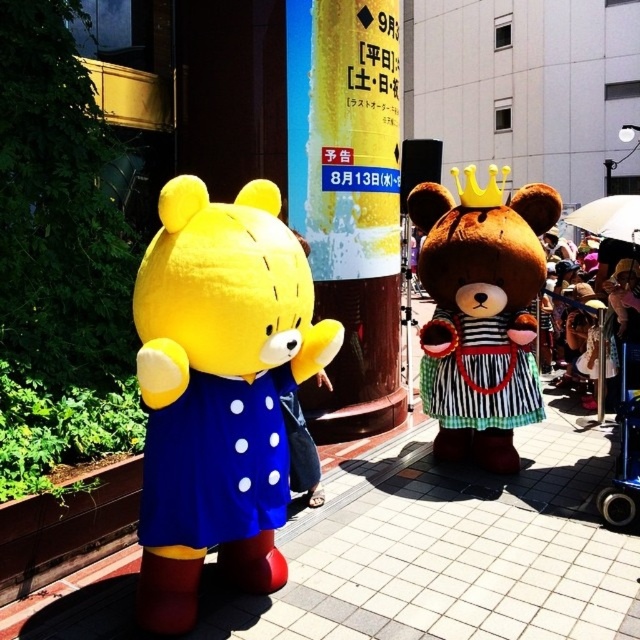
You are a street performer trying to set up a small stage for a show. You have a stage that is exactly the width of the blue fabric dress at left. Can you place this stage on the smooth concrete pavement at center without it overhanging the edges?

The smooth concrete pavement at center is wider than the blue fabric dress at left, so yes, the stage can be placed on the smooth concrete pavement at center without overhanging since its width is sufficient.

You are a visitor at this event and want to read the yellow fabric signpost at center. However, you notice the brown plush bear at center is blocking your view. Can you see the signpost clearly?

The yellow fabric signpost at center is located above the brown plush bear at center, so you can see the signpost clearly by looking over the top of the bear.